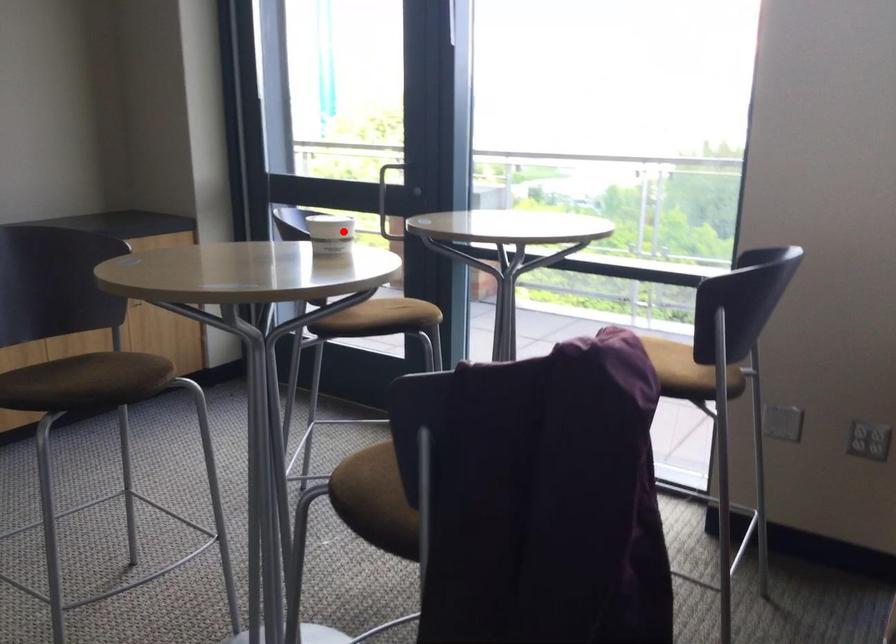
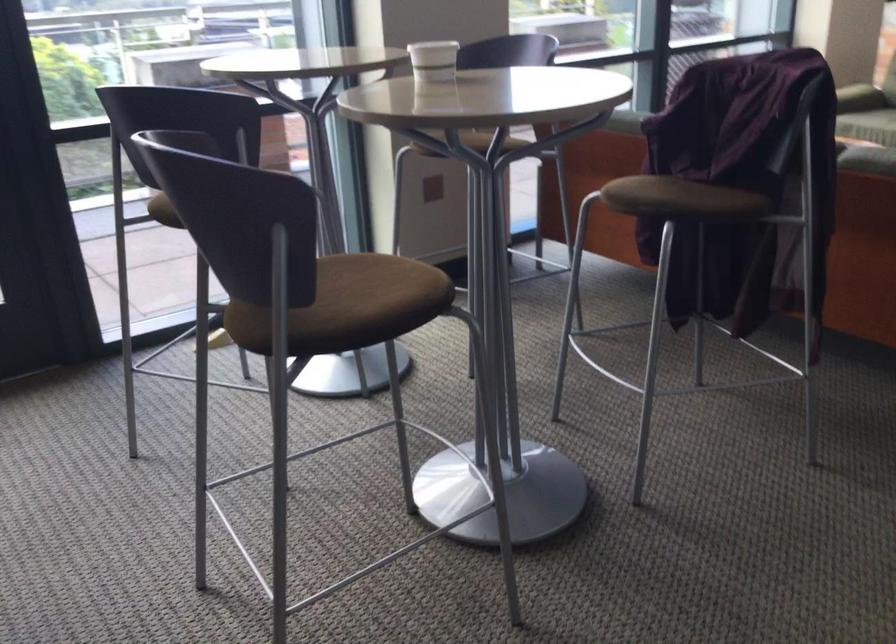
Find the pixel in the second image that matches the highlighted location in the first image.

(433, 61)